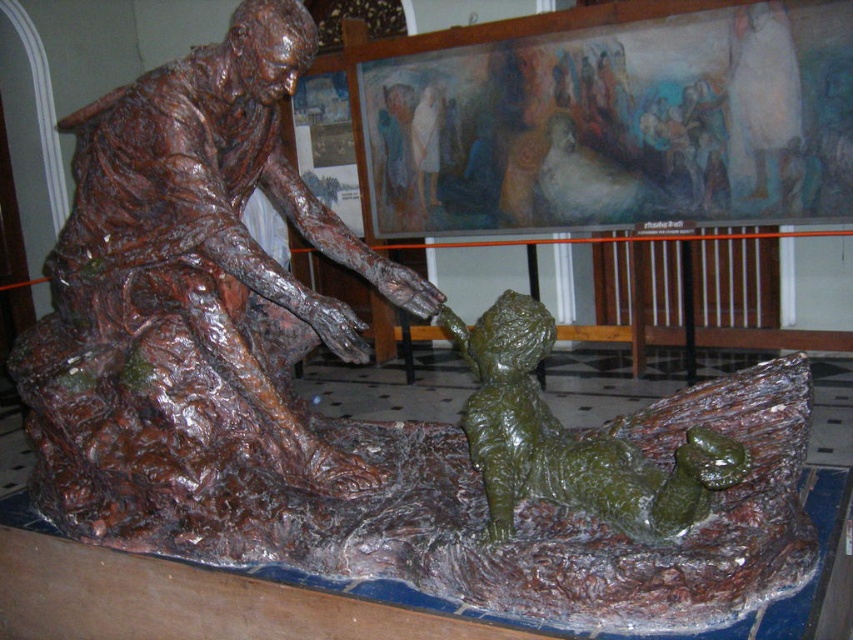
Question: Is bronze statue at center thinner than green wax boy at center?

Choices:
 (A) no
 (B) yes

Answer: (A)

Question: Does bronze statue at center have a smaller size compared to green wax boy at center?

Choices:
 (A) yes
 (B) no

Answer: (B)

Question: Is bronze statue at center to the left of green wax boy at center from the viewer's perspective?

Choices:
 (A) yes
 (B) no

Answer: (A)

Question: Which of the following is the farthest from the observer?

Choices:
 (A) (521, 449)
 (B) (126, 285)

Answer: (B)